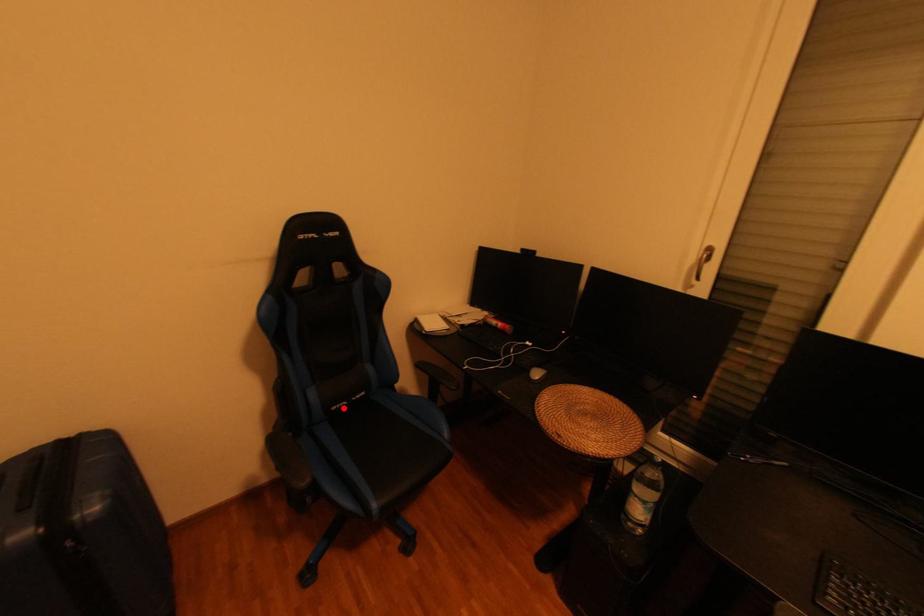
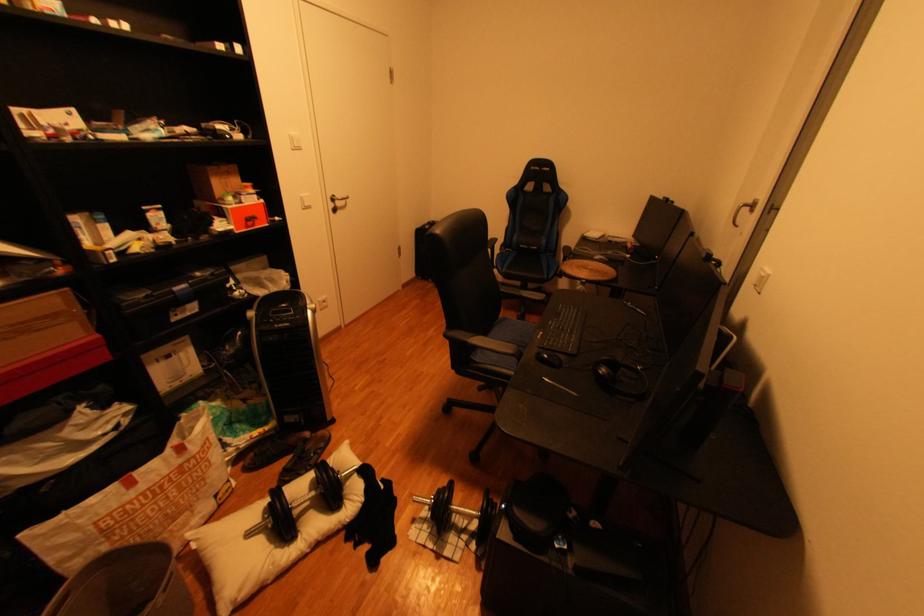
Question: I am providing you with two images of the same scene from different viewpoints. In image1, a red point is highlighted. Considering the same 3D point in image2, which of the following is correct?

Choices:
 (A) It is closer
 (B) It is farther

Answer: (A)